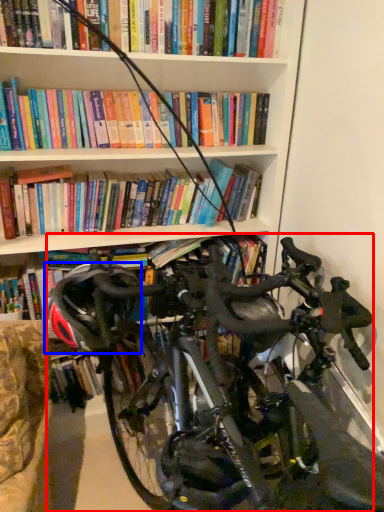
Question: Which object appears closest to the camera in this image, bicycle (highlighted by a red box) or helmet (highlighted by a blue box)?

Choices:
 (A) bicycle
 (B) helmet

Answer: (A)